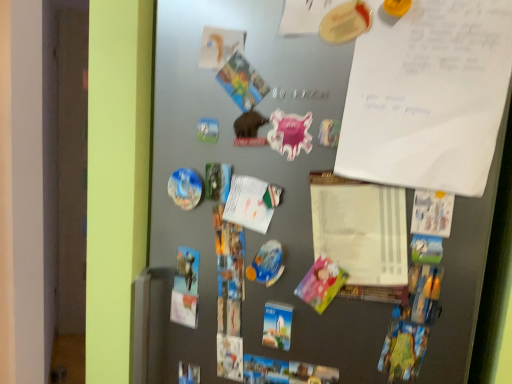
Question: Can you confirm if glossy plastic magnet at center-left, marked as the first art in a back-to-front arrangement, is taller than metallic gray fridge at center?

Choices:
 (A) yes
 (B) no

Answer: (B)

Question: Is glossy plastic magnet at center-left, the second art positioned from the front, to the left of metallic gray fridge at center from the viewer's perspective?

Choices:
 (A) yes
 (B) no

Answer: (A)

Question: Is the depth of glossy plastic magnet at center-left, which appears as the 2th art when viewed from the right, greater than that of metallic gray fridge at center?

Choices:
 (A) yes
 (B) no

Answer: (A)

Question: From a real-world perspective, is glossy plastic magnet at center-left, which is the first art from left to right, on metallic gray fridge at center?

Choices:
 (A) no
 (B) yes

Answer: (B)

Question: From the image's perspective, is glossy plastic magnet at center-left, which appears as the 2th art when viewed from the right, above metallic gray fridge at center?

Choices:
 (A) yes
 (B) no

Answer: (A)

Question: Is white paper at upper right inside the boundaries of glossy plastic magnet at center-left, which is counted as the first art, starting from the bottom, or outside?

Choices:
 (A) outside
 (B) inside

Answer: (A)

Question: In the image, is white paper at upper right on the left side or the right side of glossy plastic magnet at center-left, marked as the first art in a back-to-front arrangement?

Choices:
 (A) left
 (B) right

Answer: (B)

Question: Is white paper at upper right wider or thinner than glossy plastic magnet at center-left, the second art positioned from the front?

Choices:
 (A) thin
 (B) wide

Answer: (B)

Question: Relative to glossy plastic magnet at center-left, which appears as the 2th art when viewed from the right, is white paper at upper right in front or behind?

Choices:
 (A) behind
 (B) front

Answer: (B)

Question: From a real-world perspective, is pink glossy magnet at center, which is counted as the second art, starting from the bottom, physically located above or below white paper at center?

Choices:
 (A) below
 (B) above

Answer: (B)

Question: Would you say pink glossy magnet at center, which is counted as the second art, starting from the bottom, is to the left or to the right of white paper at center in the picture?

Choices:
 (A) right
 (B) left

Answer: (B)

Question: Is pink glossy magnet at center, the second art from the left, taller or shorter than white paper at center?

Choices:
 (A) short
 (B) tall

Answer: (A)

Question: Is pink glossy magnet at center, which is counted as the second art, starting from the bottom, spatially inside white paper at center, or outside of it?

Choices:
 (A) outside
 (B) inside

Answer: (A)

Question: Does point (336, 256) appear closer or farther from the camera than point (195, 192)?

Choices:
 (A) closer
 (B) farther

Answer: (A)

Question: Considering the relative positions of white paper at center and glossy plastic magnet at center-left, marked as the first art in a back-to-front arrangement, in the image provided, is white paper at center to the left or to the right of glossy plastic magnet at center-left, marked as the first art in a back-to-front arrangement,?

Choices:
 (A) right
 (B) left

Answer: (A)